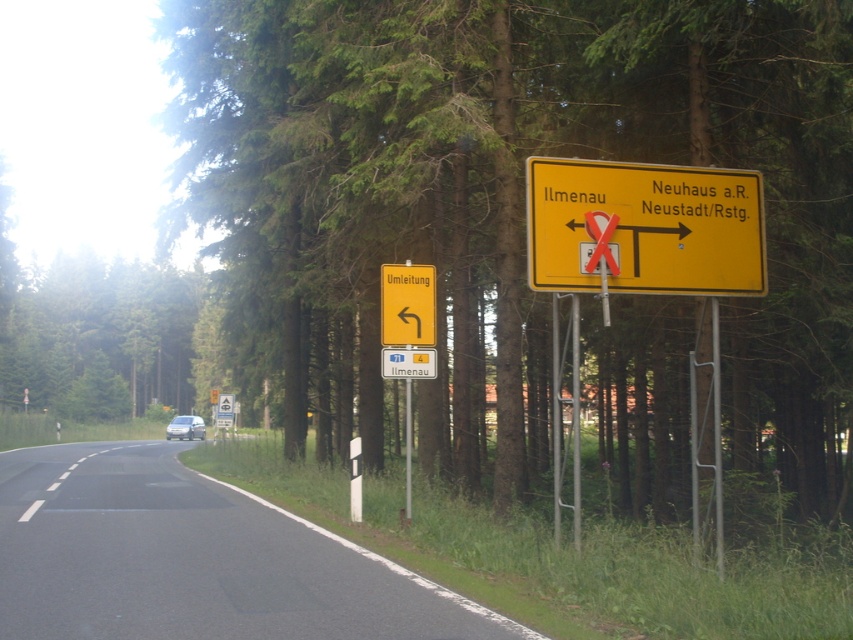
Question: Observing the image, what is the correct spatial positioning of green leafy tree at center in reference to yellow matte sign at upper right?

Choices:
 (A) left
 (B) right

Answer: (A)

Question: Which object is the farthest from the yellow matte sign at upper right?

Choices:
 (A) white matte van at center
 (B) green leafy tree at center
 (C) yellow plastic road sign at upper center

Answer: (A)

Question: Which point appears closest to the camera in this image?

Choices:
 (A) (426, 244)
 (B) (186, 432)
 (C) (578, 221)

Answer: (C)

Question: Among these objects, which one is farthest from the camera?

Choices:
 (A) yellow plastic road sign at upper center
 (B) green leafy tree at center
 (C) white matte van at center

Answer: (C)

Question: Can you confirm if green leafy tree at center is positioned above yellow matte sign at upper right?

Choices:
 (A) yes
 (B) no

Answer: (B)

Question: Where is yellow matte sign at upper right located in relation to white matte van at center in the image?

Choices:
 (A) below
 (B) above

Answer: (B)